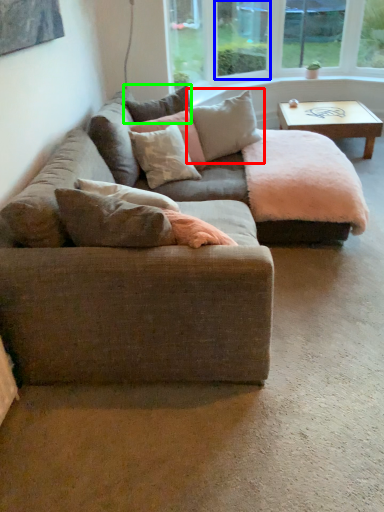
Question: Estimate the real-world distances between objects in this image. Which object is farther from pillow (highlighted by a red box), window screen (highlighted by a blue box) or pillow (highlighted by a green box)?

Choices:
 (A) window screen
 (B) pillow

Answer: (A)